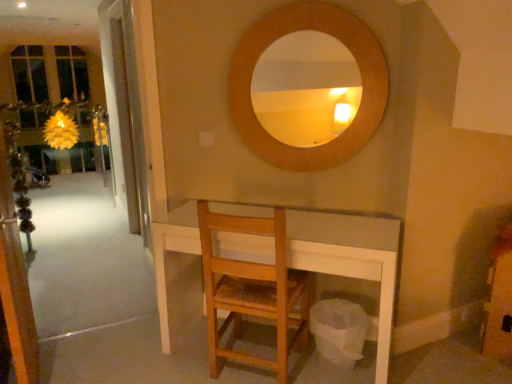
Question: Is wooden chair at center not within clear glass door at left, the first screen door in the back-to-front sequence?

Choices:
 (A) yes
 (B) no

Answer: (A)

Question: From the image's perspective, does wooden chair at center appear higher than clear glass door at left, the first screen door in the back-to-front sequence?

Choices:
 (A) no
 (B) yes

Answer: (A)

Question: Can you confirm if wooden chair at center is shorter than clear glass door at left, which is counted as the 2th screen door, starting from the front?

Choices:
 (A) no
 (B) yes

Answer: (B)

Question: Is wooden chair at center in front of clear glass door at left, which is counted as the 2th screen door, starting from the front?

Choices:
 (A) yes
 (B) no

Answer: (A)

Question: Is wooden chair at center bigger than clear glass door at left, which is counted as the 2th screen door, starting from the front?

Choices:
 (A) yes
 (B) no

Answer: (A)

Question: Is clear glass door at left, the first screen door in the back-to-front sequence, in front of or behind transparent glass screen door at left, the second screen door from the back, in the image?

Choices:
 (A) behind
 (B) front

Answer: (A)

Question: From their relative heights in the image, would you say clear glass door at left, the first screen door in the back-to-front sequence, is taller or shorter than transparent glass screen door at left, which is the first screen door from front to back?

Choices:
 (A) tall
 (B) short

Answer: (A)

Question: Looking at the image, does clear glass door at left, the first screen door in the back-to-front sequence, seem bigger or smaller compared to transparent glass screen door at left, which is the first screen door from front to back?

Choices:
 (A) big
 (B) small

Answer: (B)

Question: From a real-world perspective, relative to transparent glass screen door at left, the second screen door from the back, is clear glass door at left, the first screen door in the back-to-front sequence, vertically above or below?

Choices:
 (A) above
 (B) below

Answer: (A)

Question: In terms of height, does wooden chair at center look taller or shorter compared to clear glass door at left, which is counted as the 2th screen door, starting from the front?

Choices:
 (A) short
 (B) tall

Answer: (A)

Question: From the image's perspective, is wooden chair at center located above or below clear glass door at left, the first screen door in the back-to-front sequence?

Choices:
 (A) above
 (B) below

Answer: (B)

Question: From a real-world perspective, relative to clear glass door at left, the first screen door in the back-to-front sequence, is wooden chair at center vertically above or below?

Choices:
 (A) above
 (B) below

Answer: (B)

Question: Looking at the image, does wooden chair at center seem bigger or smaller compared to clear glass door at left, the first screen door in the back-to-front sequence?

Choices:
 (A) small
 (B) big

Answer: (B)

Question: Is point pos(123,145) positioned closer to the camera than point pos(230,266)?

Choices:
 (A) farther
 (B) closer

Answer: (A)

Question: Is clear glass door at left, which is counted as the 2th screen door, starting from the front, inside or outside of wooden chair at center?

Choices:
 (A) outside
 (B) inside

Answer: (A)